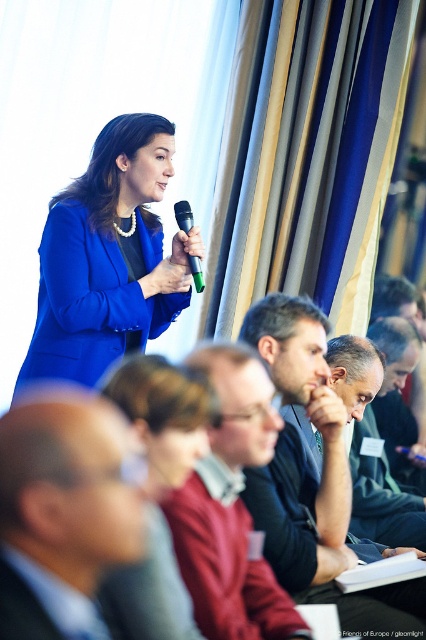
Question: Which point is closer to the camera?

Choices:
 (A) dark blue shirt at center
 (B) matte blue suit at upper left
 (C) matte blue suit at center
 (D) green plastic microphone at upper center

Answer: (B)

Question: Which object is the farthest from the red sweater at center?

Choices:
 (A) green plastic microphone at upper center
 (B) matte blue suit at center
 (C) dark gray sweater at center
 (D) matte blue suit at upper left

Answer: (A)

Question: From the image, what is the correct spatial relationship of dark gray sweater at center in relation to matte blue suit at upper left?

Choices:
 (A) left
 (B) right

Answer: (B)

Question: Can you confirm if bald head at center is positioned below dark blue shirt at center?

Choices:
 (A) yes
 (B) no

Answer: (B)

Question: Is the position of bald head at center less distant than that of green plastic microphone at upper center?

Choices:
 (A) yes
 (B) no

Answer: (A)

Question: Among these objects, which one is nearest to the camera?

Choices:
 (A) bald head at center
 (B) matte blue suit at upper left

Answer: (A)